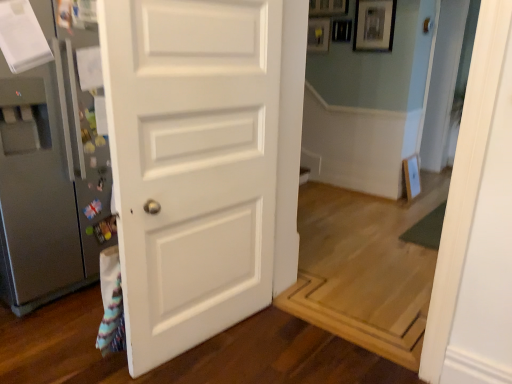
Identify the location of satin silver refrigerator at left. (51, 172).

Identify the location of silver metallic door handle at center. (426, 25).

This screenshot has height=384, width=512. What are the coordinates of `transparent glass door at upper right` in the screenshot? It's located at (447, 79).

Does matte black picture frame at upper center have a smaller size compared to satin silver refrigerator at left?

Yes.

From the image's perspective, which is below, matte black picture frame at upper center or satin silver refrigerator at left?

satin silver refrigerator at left, from the image's perspective.

Which of these two, matte black picture frame at upper center or satin silver refrigerator at left, stands taller?

satin silver refrigerator at left.

In the scene shown: Who is shorter, satin silver refrigerator at left or transparent glass door at upper right?

satin silver refrigerator at left.

From a real-world perspective, is satin silver refrigerator at left above or below transparent glass door at upper right?

satin silver refrigerator at left is situated lower than transparent glass door at upper right in the real world.

How many degrees apart are the facing directions of satin silver refrigerator at left and transparent glass door at upper right?

3.39 degrees separate the facing orientations of satin silver refrigerator at left and transparent glass door at upper right.

Is silver metallic door handle at center outside of white matte door at center?

Yes, silver metallic door handle at center is not within white matte door at center.

From the image's perspective, is silver metallic door handle at center on top of white matte door at center?

Yes.

Find the location of a particular element. The height and width of the screenshot is (384, 512). door handle located above the white matte door at center (from a real-world perspective) is located at coordinates (426, 25).

Is silver metallic door handle at center positioned with its back to white matte door at center?

No.

Does white matte door at center turn towards transparent glass door at upper right?

No, white matte door at center is not turned towards transparent glass door at upper right.

Is white matte door at center taller or shorter than transparent glass door at upper right?

white matte door at center is shorter than transparent glass door at upper right.

In the image, is white matte door at center positioned in front of or behind transparent glass door at upper right?

Clearly, white matte door at center is in front of transparent glass door at upper right.

From a real-world perspective, relative to transparent glass door at upper right, is white matte door at center vertically above or below?

white matte door at center is situated lower than transparent glass door at upper right in the real world.

Consider the image. Is transparent glass door at upper right facing away from silver metallic door handle at center?

That's not correct — transparent glass door at upper right is not looking away from silver metallic door handle at center.

Consider the image. From a real-world perspective, between transparent glass door at upper right and silver metallic door handle at center, who is vertically higher?

In real-world perspective, silver metallic door handle at center is above.

Which point is more distant from viewer, (426, 124) or (424, 22)?

Positioned behind is point (426, 124).

In terms of width, does transparent glass door at upper right look wider or thinner when compared to silver metallic door handle at center?

In the image, transparent glass door at upper right appears to be wider than silver metallic door handle at center.

Consider the image. Would you say transparent glass door at upper right is inside or outside white matte door at center?

The correct answer is: outside.

Which of these two, transparent glass door at upper right or white matte door at center, is thinner?

transparent glass door at upper right is thinner.

From the image's perspective, which object appears higher, transparent glass door at upper right or white matte door at center?

From the image's view, transparent glass door at upper right is above.

Is transparent glass door at upper right oriented towards white matte door at center?

No, transparent glass door at upper right does not turn towards white matte door at center.

Who is bigger, matte black picture frame at upper center or white matte door at center?

With larger size is white matte door at center.

You are a GUI agent. You are given a task and a screenshot of the screen. Output one action in this format:
    pyautogui.click(x=<x>, y=<y>)
    Task: Click on the picture frame that is above the white matte door at center (from a real-world perspective)
    The image size is (512, 384).
    Given the screenshot: What is the action you would take?
    pyautogui.click(x=374, y=25)

Choose the correct answer: Is matte black picture frame at upper center inside white matte door at center or outside it?

matte black picture frame at upper center cannot be found inside white matte door at center.

Which is more distant, (360, 1) or (289, 91)?

The point (360, 1) is farther.

What are the coordinates of `picture frame above the satin silver refrigerator at left (from a real-world perspective)` in the screenshot? It's located at (374, 25).

In order to click on glass door behind the satin silver refrigerator at left in this screenshot , I will do `click(447, 79)`.

When comparing their distances from white matte door at center, does transparent glass door at upper right or satin silver refrigerator at left seem further?

The object further to white matte door at center is transparent glass door at upper right.

Estimate the real-world distances between objects in this image. Which object is closer to silver metallic door handle at center, transparent glass door at upper right or satin silver refrigerator at left?

transparent glass door at upper right.

From the image, which object appears to be nearer to silver metallic door handle at center, white matte door at center or matte black picture frame at upper center?

matte black picture frame at upper center lies closer to silver metallic door handle at center than the other object.

Looking at the image, which one is located closer to matte black picture frame at upper center, transparent glass door at upper right or satin silver refrigerator at left?

transparent glass door at upper right lies closer to matte black picture frame at upper center than the other object.

Based on their spatial positions, is matte black picture frame at upper center or satin silver refrigerator at left further from silver metallic door handle at center?

Among the two, satin silver refrigerator at left is located further to silver metallic door handle at center.

Looking at the image, which one is located closer to satin silver refrigerator at left, transparent glass door at upper right or silver metallic door handle at center?

silver metallic door handle at center.

Considering their positions, is white matte door at center positioned closer to matte black picture frame at upper center than satin silver refrigerator at left?

Based on the image, white matte door at center appears to be nearer to matte black picture frame at upper center.

Looking at this image, looking at the image, which one is located closer to transparent glass door at upper right, silver metallic door handle at center or matte black picture frame at upper center?

silver metallic door handle at center lies closer to transparent glass door at upper right than the other object.

Locate an element on the screen. The height and width of the screenshot is (384, 512). door between satin silver refrigerator at left and transparent glass door at upper right from left to right is located at coordinates (198, 161).

The height and width of the screenshot is (384, 512). I want to click on picture frame located between satin silver refrigerator at left and silver metallic door handle at center in the left-right direction, so click(x=374, y=25).

The width and height of the screenshot is (512, 384). Find the location of `picture frame between white matte door at center and transparent glass door at upper right along the z-axis`. picture frame between white matte door at center and transparent glass door at upper right along the z-axis is located at coordinates (374, 25).

Where is `door between satin silver refrigerator at left and silver metallic door handle at center in the horizontal direction`? The width and height of the screenshot is (512, 384). door between satin silver refrigerator at left and silver metallic door handle at center in the horizontal direction is located at coordinates (198, 161).